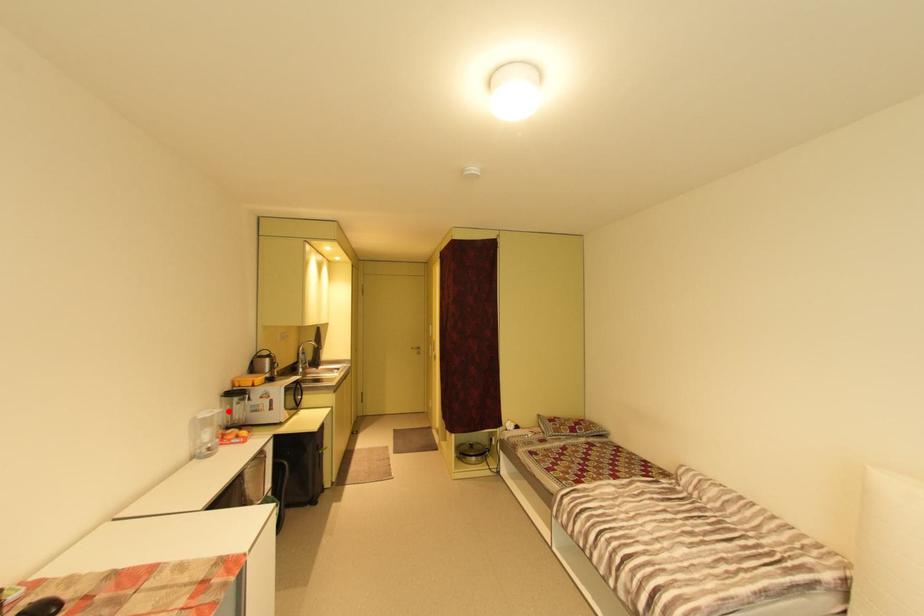
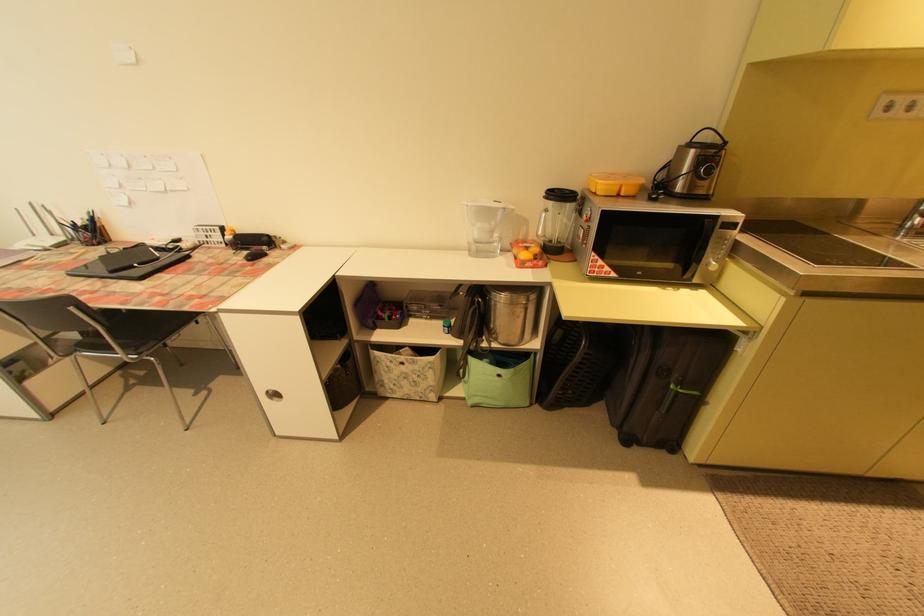
Find the pixel in the second image that matches the highlighted location in the first image.

(511, 209)